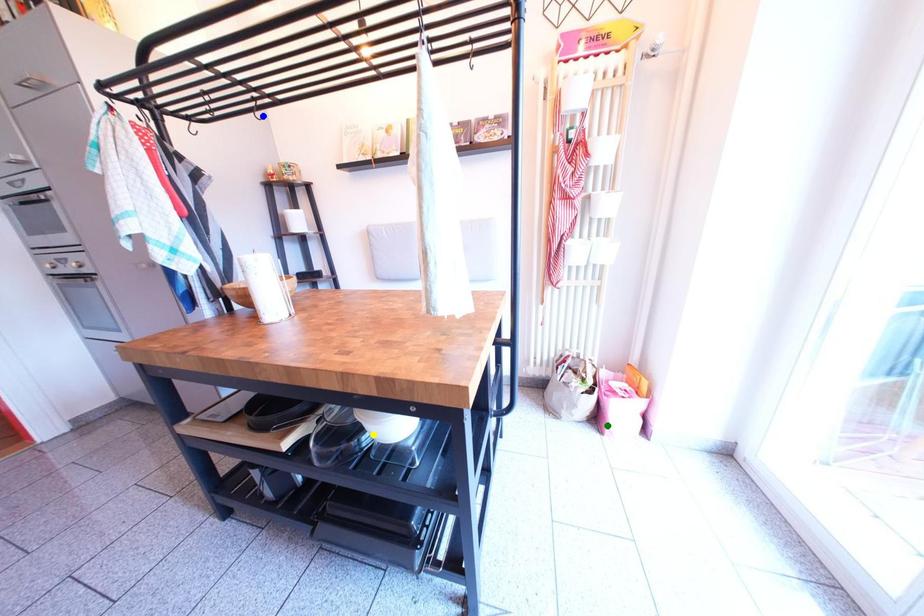
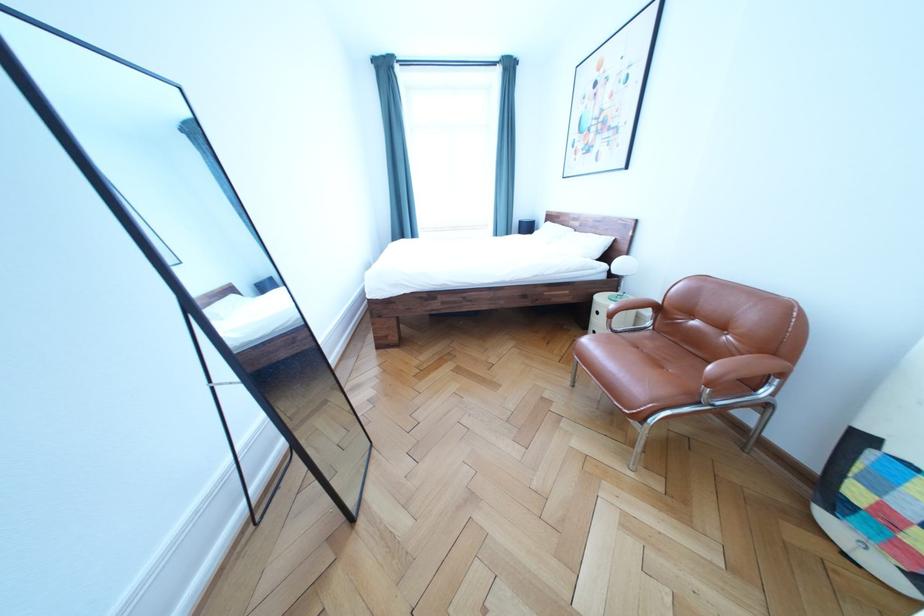
I am providing you with two images of the same scene from different viewpoints. Three points are marked in image1. Which point corresponds to a part or object that is occluded in image2?In image1, three points are marked. Which of them correspond to a part or object that is occluded in image2?Among the three points shown in image1, which one corresponds to a part or object that is no longer visible due to occlusion in image2?

green point, blue point, yellow point cannot be seen in image2.